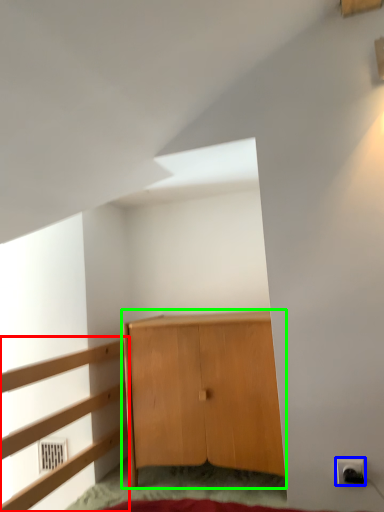
Question: Considering the real-world distances, which object is closest to dresser (highlighted by a red box)? electric outlet (highlighted by a blue box) or cupboard (highlighted by a green box).

Choices:
 (A) electric outlet
 (B) cupboard

Answer: (B)